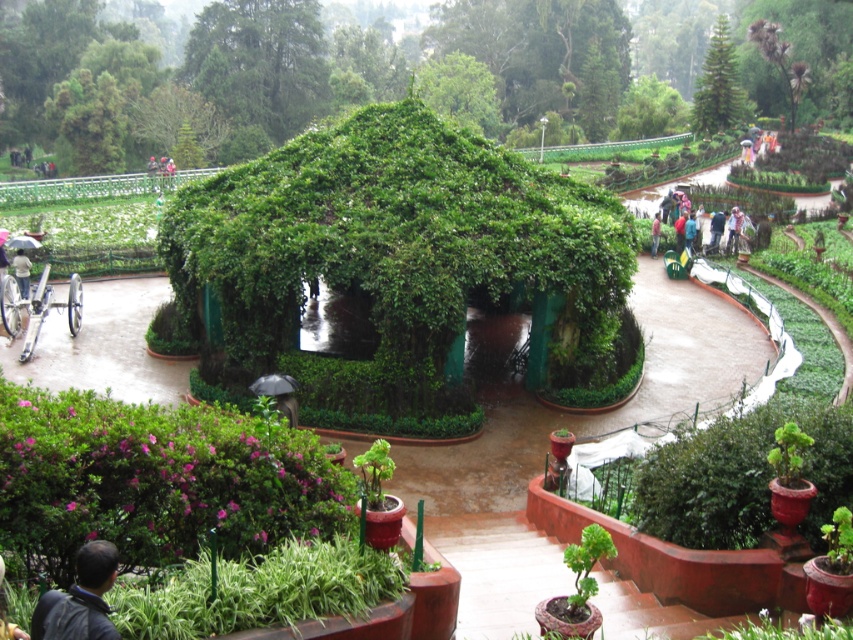
Question: Which of the following is the closest to the observer?

Choices:
 (A) light blue jeans at center
 (B) green leafy hedge at center
 (C) green leafy umbrella at center

Answer: (B)

Question: Can you confirm if green leafy hedge at center is thinner than dark blue shirt at lower left?

Choices:
 (A) no
 (B) yes

Answer: (A)

Question: Which of the following is the farthest from the observer?

Choices:
 (A) (86, 588)
 (B) (18, 636)
 (C) (833, 502)
 (D) (503, 280)

Answer: (D)

Question: Which point is farther from the camera taking this photo?

Choices:
 (A) (820, 467)
 (B) (265, 289)
 (C) (115, 554)

Answer: (B)

Question: Can you confirm if green leafy umbrella at center is smaller than light blue fabric umbrella at lower left?

Choices:
 (A) yes
 (B) no

Answer: (B)

Question: Observing the image, what is the correct spatial positioning of green leafy umbrella at center in reference to light blue fabric umbrella at lower left?

Choices:
 (A) right
 (B) left

Answer: (A)